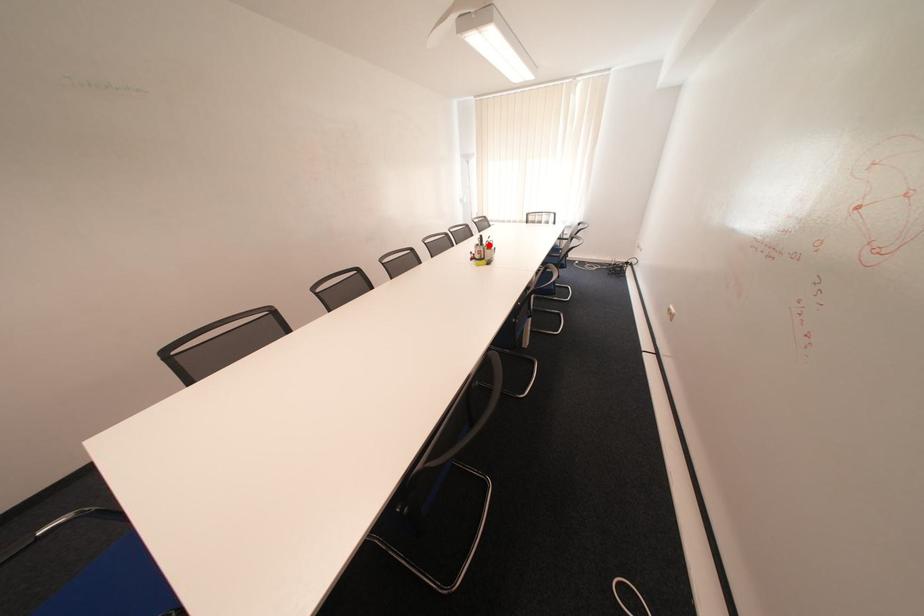
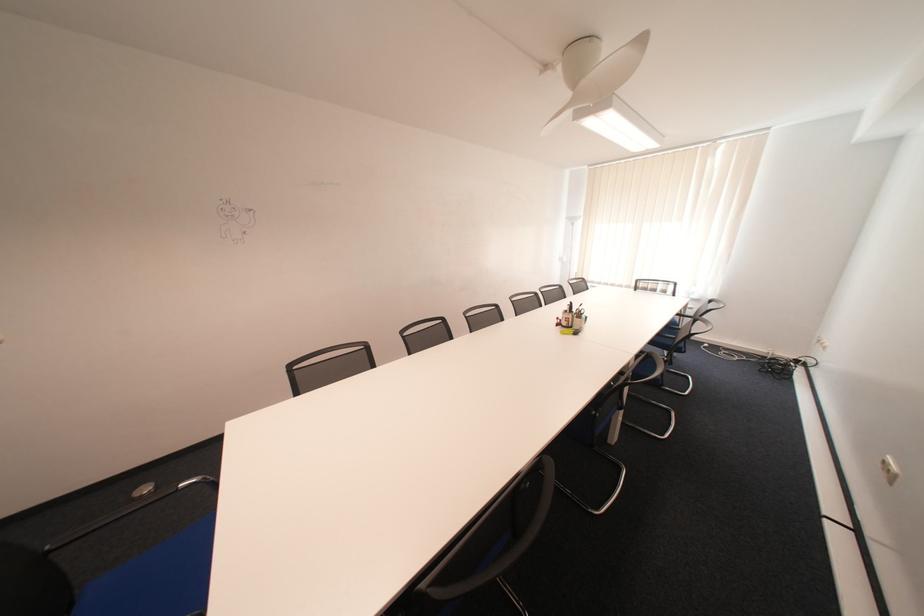
Question: I am providing you with two images of the same scene from different viewpoints. Image1 has a red point marked. In image2, the corresponding 3D location appears at what relative position? Reply with the corresponding letter.

Choices:
 (A) Closer
 (B) Farther

Answer: (B)